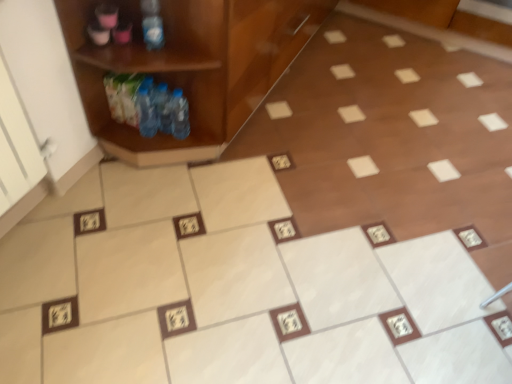
Question: Would you consider blue plastic bottle at upper left, arranged as the first bottle when viewed from the front, to be distant from wooden cabinet at left?

Choices:
 (A) no
 (B) yes

Answer: (A)

Question: Are blue plastic bottle at upper left, the 1th bottle in the top-to-bottom sequence, and wooden cabinet at left making contact?

Choices:
 (A) yes
 (B) no

Answer: (B)

Question: Does blue plastic bottle at upper left, arranged as the first bottle when viewed from the front, have a greater width compared to wooden cabinet at left?

Choices:
 (A) no
 (B) yes

Answer: (A)

Question: Is blue plastic bottle at upper left, the 1th bottle in the top-to-bottom sequence, at the left side of wooden cabinet at left?

Choices:
 (A) no
 (B) yes

Answer: (B)

Question: Is blue plastic bottle at upper left, the second bottle viewed from the back, completely or partially outside of wooden cabinet at left?

Choices:
 (A) yes
 (B) no

Answer: (B)

Question: In the image, is blue plastic bottle at upper left, the second bottle ordered from the bottom, on the left side or the right side of wooden cabinet at left?

Choices:
 (A) right
 (B) left

Answer: (B)

Question: Is blue plastic bottle at upper left, the second bottle ordered from the bottom, inside or outside of wooden cabinet at left?

Choices:
 (A) inside
 (B) outside

Answer: (A)

Question: Is blue plastic bottle at upper left, the 1th bottle in the top-to-bottom sequence, in front of or behind wooden cabinet at left in the image?

Choices:
 (A) behind
 (B) front

Answer: (A)

Question: From the image's perspective, is blue plastic bottle at upper left, the 1th bottle in the top-to-bottom sequence, above or below wooden cabinet at left?

Choices:
 (A) below
 (B) above

Answer: (A)

Question: Which is correct: wooden cabinet at left is inside blue plastic bottle at upper left, the 1th bottle in the top-to-bottom sequence, or outside of it?

Choices:
 (A) outside
 (B) inside

Answer: (A)

Question: From the image's perspective, relative to blue plastic bottle at upper left, arranged as the first bottle when viewed from the front, is wooden cabinet at left above or below?

Choices:
 (A) above
 (B) below

Answer: (A)

Question: In terms of width, does wooden cabinet at left look wider or thinner when compared to blue plastic bottle at upper left, the second bottle ordered from the bottom?

Choices:
 (A) wide
 (B) thin

Answer: (A)

Question: From a real-world perspective, is wooden cabinet at left positioned above or below blue plastic bottle at upper left, the second bottle viewed from the back?

Choices:
 (A) below
 (B) above

Answer: (A)

Question: Is translucent plastic bottle at left, acting as the first bottle starting from the back, wider or thinner than wooden cabinet at left?

Choices:
 (A) wide
 (B) thin

Answer: (B)

Question: Considering the relative positions of translucent plastic bottle at left, acting as the first bottle starting from the back, and wooden cabinet at left in the image provided, is translucent plastic bottle at left, acting as the first bottle starting from the back, to the left or to the right of wooden cabinet at left?

Choices:
 (A) right
 (B) left

Answer: (B)